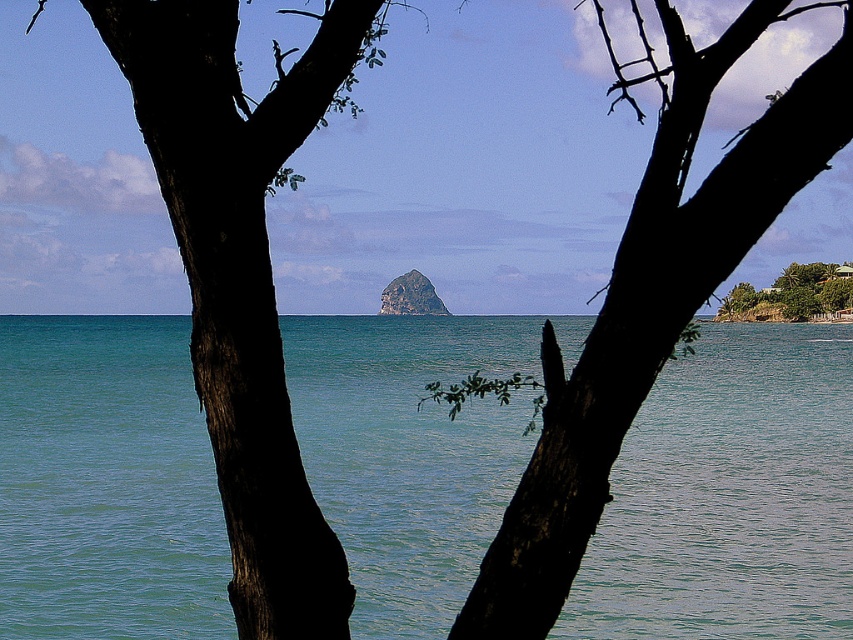
Is clear blue water at center thinner than green mossy rock at center?

No, clear blue water at center is not thinner than green mossy rock at center.

Is point (453, 536) positioned in front of point (389, 294)?

Yes, point (453, 536) is in front of point (389, 294).

Which is in front, point (200, 573) or point (410, 308)?

Point (200, 573) is more forward.

I want to click on clear blue water at center, so click(730, 497).

Is point (125, 612) more distant than point (610, 280)?

Yes, point (125, 612) is behind point (610, 280).

Does point (3, 348) come closer to viewer compared to point (636, 294)?

No, (3, 348) is behind (636, 294).

Between point (706, 406) and point (821, 4), which one is positioned behind?

The point (706, 406) is more distant.

At what (x,y) coordinates should I click in order to perform the action: click on clear blue water at center. Please return your answer as a coordinate pair (x, y). Image resolution: width=853 pixels, height=640 pixels. Looking at the image, I should click on (730, 497).

Does green leafy tree at right have a greater height compared to green mossy rock at center?

Correct, green leafy tree at right is much taller as green mossy rock at center.

Who is positioned more to the right, green leafy tree at right or green mossy rock at center?

From the viewer's perspective, green leafy tree at right appears more on the right side.

This screenshot has width=853, height=640. What are the coordinates of `green leafy tree at right` in the screenshot? It's located at (792, 292).

Identify the location of green leafy tree at right. This screenshot has width=853, height=640. 792,292.